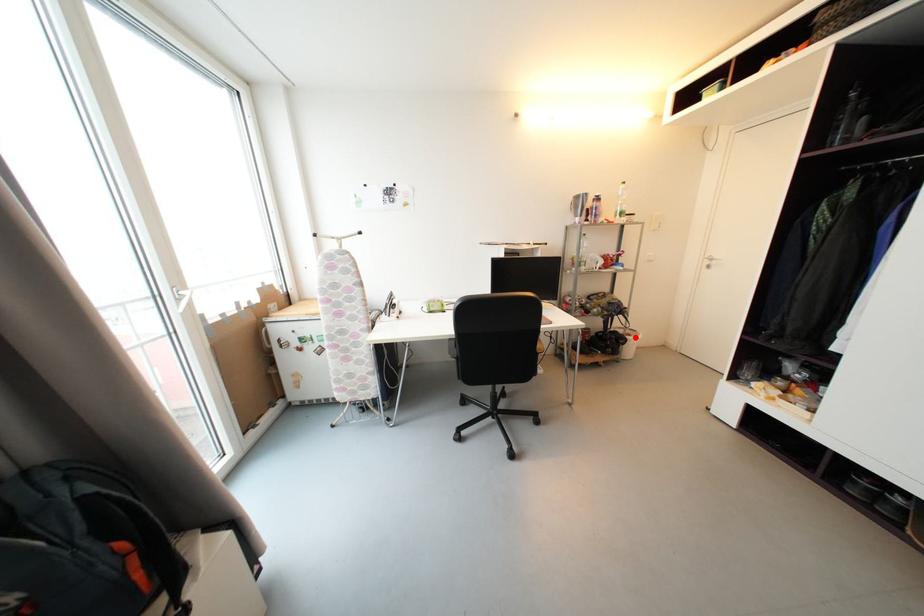
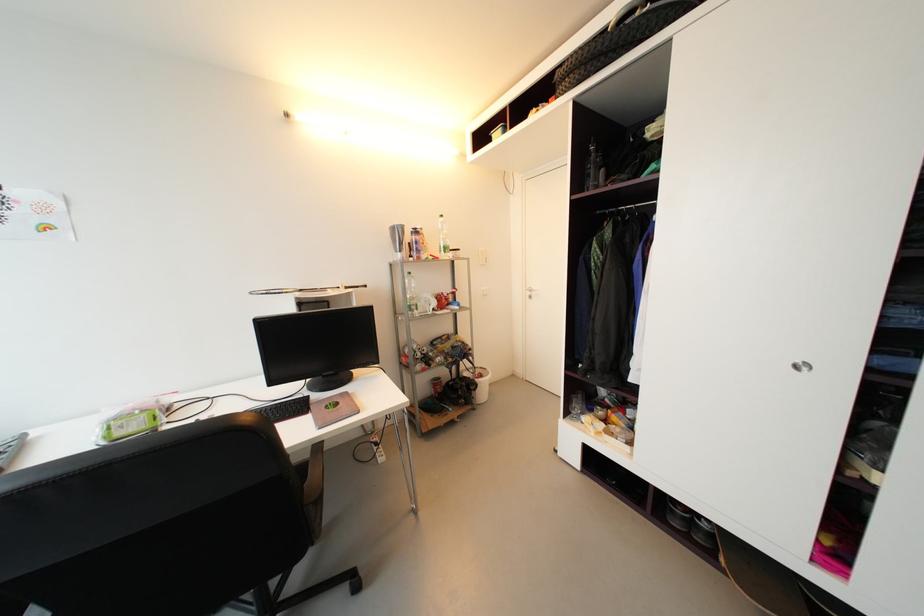
Find the pixel in the second image that matches the highlighted location in the first image.

(487, 378)